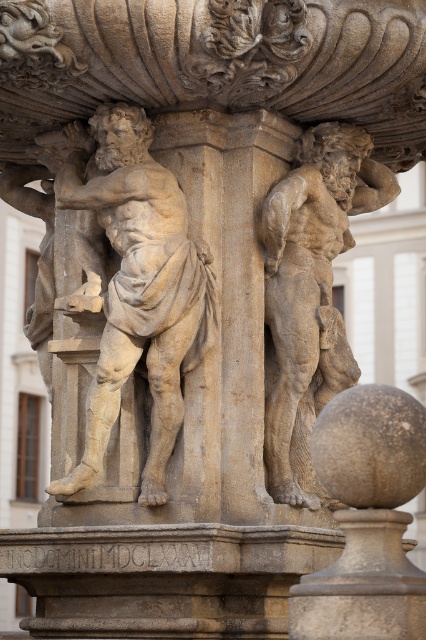
You are an art student analyzing the fountain structure. You notice two figures at the center of the fountain. Which one, the beige stone statue at center or the stone textured figure at center, is positioned higher in elevation?

The beige stone statue at center is positioned higher in elevation than the stone textured figure at center, as it is located above it.